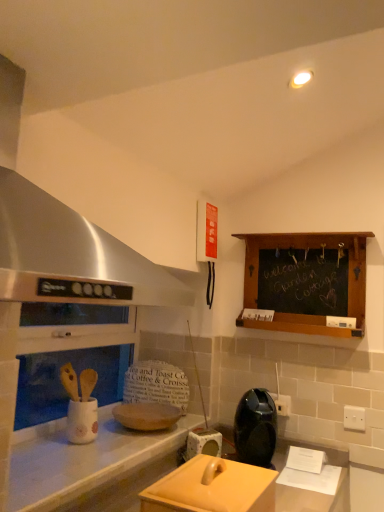
Question: Is black plastic electric outlet at center-right, the 2th electric outlet when ordered from front to back, not inside matte beige toaster at center, arranged as the 1th appliance when viewed from the back?

Choices:
 (A) no
 (B) yes

Answer: (B)

Question: From a real-world perspective, is black plastic electric outlet at center-right, which appears as the second electric outlet when viewed from the right, positioned under matte beige toaster at center, positioned as the 3th appliance in front-to-back order, based on gravity?

Choices:
 (A) no
 (B) yes

Answer: (A)

Question: Is black plastic electric outlet at center-right, which appears as the second electric outlet when viewed from the right, closer to camera compared to matte beige toaster at center, arranged as the 1th appliance when viewed from the back?

Choices:
 (A) yes
 (B) no

Answer: (B)

Question: Can matte beige toaster at center, positioned as the 3th appliance in front-to-back order, be found inside black plastic electric outlet at center-right, the first electric outlet in the back-to-front sequence?

Choices:
 (A) no
 (B) yes

Answer: (A)

Question: Considering the relative positions of black plastic electric outlet at center-right, the 2th electric outlet when ordered from front to back, and matte beige toaster at center, arranged as the 1th appliance when viewed from the back, in the image provided, is black plastic electric outlet at center-right, the 2th electric outlet when ordered from front to back, to the right of matte beige toaster at center, arranged as the 1th appliance when viewed from the back, from the viewer's perspective?

Choices:
 (A) yes
 (B) no

Answer: (A)

Question: Considering the relative sizes of black plastic electric outlet at center-right, positioned as the 1th electric outlet in left-to-right order, and matte beige toaster at center, positioned as the 3th appliance in front-to-back order, in the image provided, is black plastic electric outlet at center-right, positioned as the 1th electric outlet in left-to-right order, shorter than matte beige toaster at center, positioned as the 3th appliance in front-to-back order,?

Choices:
 (A) yes
 (B) no

Answer: (A)

Question: Does black plastic electric outlet at center-right, which appears as the second electric outlet when viewed from the right, have a larger size compared to chalkboard wood at upper right?

Choices:
 (A) yes
 (B) no

Answer: (B)

Question: Can you confirm if black plastic electric outlet at center-right, the 2th electric outlet when ordered from front to back, is smaller than chalkboard wood at upper right?

Choices:
 (A) yes
 (B) no

Answer: (A)

Question: From a real-world perspective, does black plastic electric outlet at center-right, the 2th electric outlet when ordered from front to back, stand above chalkboard wood at upper right?

Choices:
 (A) yes
 (B) no

Answer: (B)

Question: Is chalkboard wood at upper right at the back of black plastic electric outlet at center-right, the first electric outlet in the back-to-front sequence?

Choices:
 (A) no
 (B) yes

Answer: (A)

Question: Can you confirm if black plastic electric outlet at center-right, positioned as the 1th electric outlet in left-to-right order, is shorter than chalkboard wood at upper right?

Choices:
 (A) no
 (B) yes

Answer: (B)

Question: Does black plastic electric outlet at center-right, the 2th electric outlet when ordered from front to back, have a greater width compared to chalkboard wood at upper right?

Choices:
 (A) no
 (B) yes

Answer: (A)

Question: Considering the relative sizes of white plastic electric outlet at upper right, which ranks as the 1th electric outlet in front-to-back order, and black plastic electric outlet at center-right, the 2th electric outlet when ordered from front to back, in the image provided, is white plastic electric outlet at upper right, which ranks as the 1th electric outlet in front-to-back order, shorter than black plastic electric outlet at center-right, the 2th electric outlet when ordered from front to back,?

Choices:
 (A) yes
 (B) no

Answer: (B)